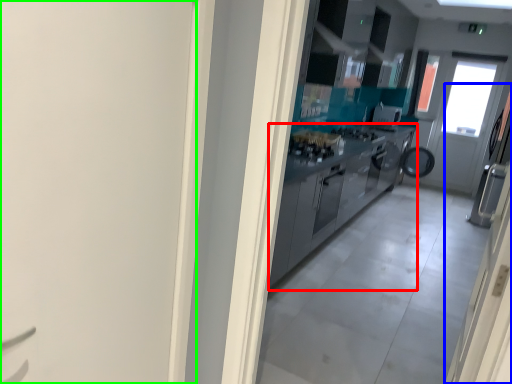
Question: Based on their relative distances, which object is farther from cabinetry (highlighted by a red box)? Choose from door (highlighted by a blue box) and door (highlighted by a green box).

Choices:
 (A) door
 (B) door

Answer: (A)